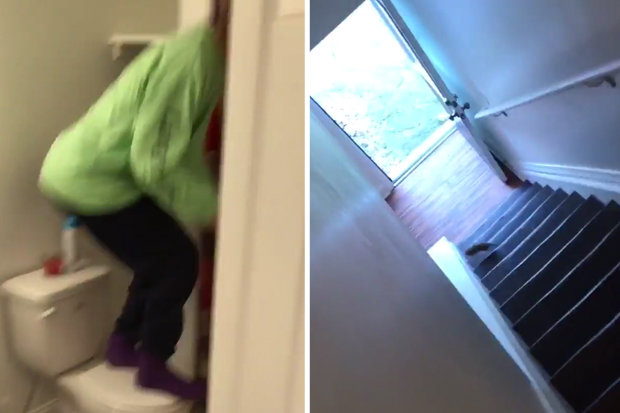
Where is `trim`? trim is located at coordinates (583, 186).